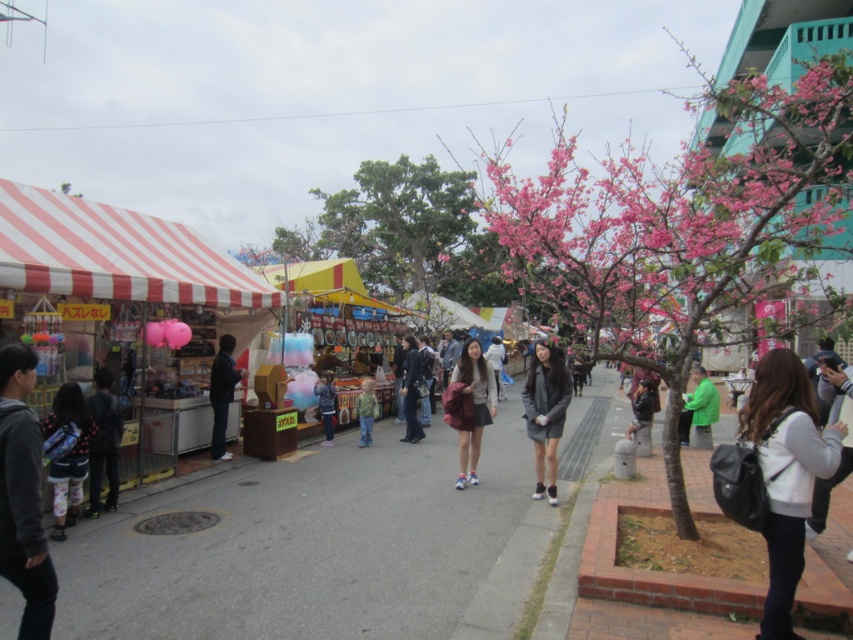
You are standing at the entrance of the market and want to take a photo of two specific points in the scene. The first point is at coordinates point (189, 273) and the second is at point (480, 433). Which point should you focus on first to ensure it appears larger in your photo?

Point (189, 273) should be focused on first because it is closer to the viewer than point (480, 433), making it appear larger in the photo.

You are standing at the entrance of the market and see a person wearing a dark gray sweatshirt at lower left. Where exactly is this person located in relation to the stalls under the red and white striped canopies on the left side?

The dark gray sweatshirt at lower left is located at point 0.773 on the x axis and 0.028 on the y axis, which places them near the lower left corner of the image, close to the stalls under the red and white striped canopies on the left side.

You are a vendor at the market and want to place a new stand that is the same size as the matte gray sweater at center next to the red and white striped canopy at left. Based on the scene, will the canopy at left be wider than your new stand?

The red and white striped canopy at left is wider than the matte gray sweater at center, so yes, the canopy at left will be wider than the new stand.